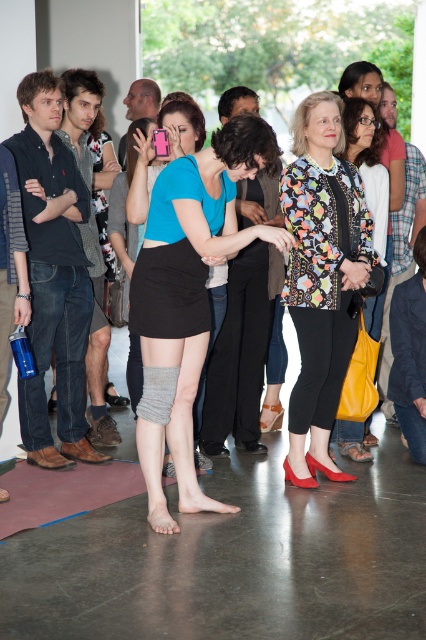
Question: Does gray knit knee-high socks at center appear on the right side of floral print blouse at center?

Choices:
 (A) yes
 (B) no

Answer: (B)

Question: Which point is farther from the camera taking this photo?

Choices:
 (A) (301, 195)
 (B) (120, 472)

Answer: (B)

Question: Among these points, which one is nearest to the camera?

Choices:
 (A) (20, 502)
 (B) (147, 224)
 (C) (385, 184)
 (D) (339, 308)

Answer: (B)

Question: Does gray knit knee-high socks at center appear over floral print blouse at center?

Choices:
 (A) no
 (B) yes

Answer: (A)

Question: Estimate the real-world distances between objects in this image. Which object is closer to the floral print blouse at center?

Choices:
 (A) printed fabric jacket at center
 (B) gray knit knee-high socks at center
 (C) matte black skirt at center

Answer: (A)

Question: Does printed fabric jacket at center appear under matte black skirt at center?

Choices:
 (A) yes
 (B) no

Answer: (B)